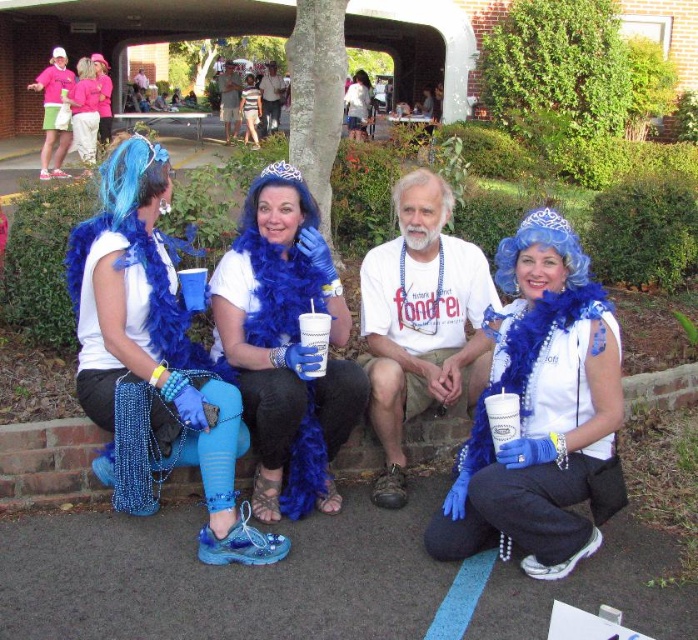
Is point (297, 486) farther from camera compared to point (343, 99)?

No.

Which of these two, blue feather boa at center or matte plastic cup at center, stands taller?

Standing taller between the two is matte plastic cup at center.

Which is in front, point (288, 486) or point (355, 125)?

Positioned in front is point (288, 486).

Where is `blue feather boa at center`? This screenshot has width=698, height=640. blue feather boa at center is located at coordinates (285, 346).

Does white paper cup at lower center have a greater width compared to white paper cup at center?

Yes.

Does white paper cup at lower center have a lesser width compared to white paper cup at center?

No.

What do you see at coordinates (503, 417) in the screenshot?
I see `white paper cup at lower center` at bounding box center [503, 417].

Find the location of a particular element. This screenshot has width=698, height=640. white paper cup at lower center is located at coordinates pyautogui.click(x=503, y=417).

Measure the distance between pink fabric dress at upper left and camera.

pink fabric dress at upper left is 13.12 meters from camera.

Who is more forward, (59, 106) or (315, 371)?

Point (315, 371) is more forward.

What are the coordinates of `pink fabric dress at upper left` in the screenshot? It's located at (52, 92).